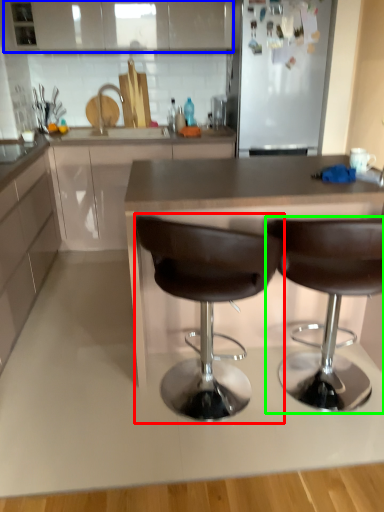
Question: Which object is the closest to the chair (highlighted by a red box)? Choose among these: cabinetry (highlighted by a blue box) or chair (highlighted by a green box).

Choices:
 (A) cabinetry
 (B) chair

Answer: (B)